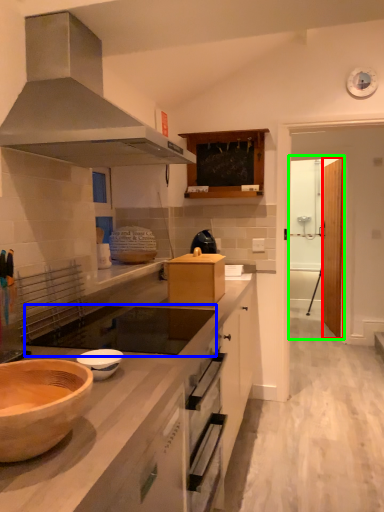
Question: Considering the real-world distances, which object is farthest from glass door (highlighted by a red box)? gas stove (highlighted by a blue box) or glass door (highlighted by a green box)?

Choices:
 (A) gas stove
 (B) glass door

Answer: (A)